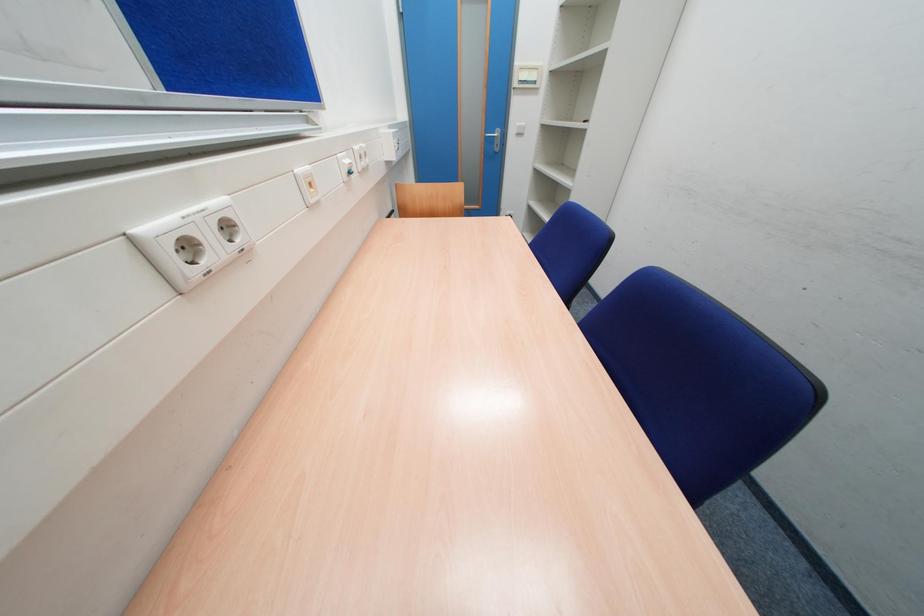
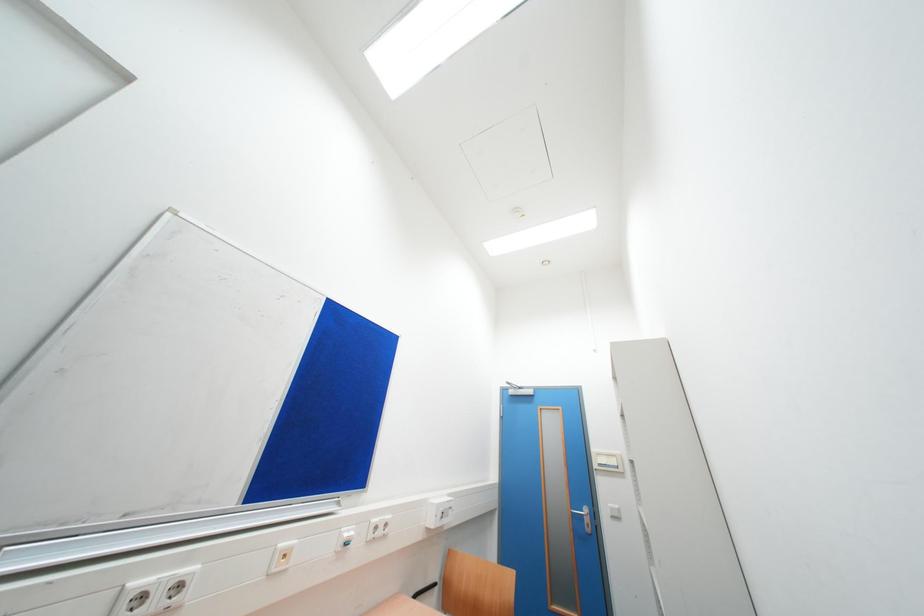
Based on the photo, how did the camera likely rotate?

The camera's rotation is toward left-up.